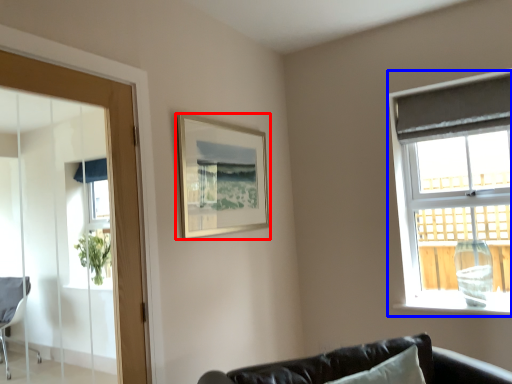
Question: Which of the following is the closest to the observer, picture frame (highlighted by a red box) or window (highlighted by a blue box)?

Choices:
 (A) picture frame
 (B) window

Answer: (A)